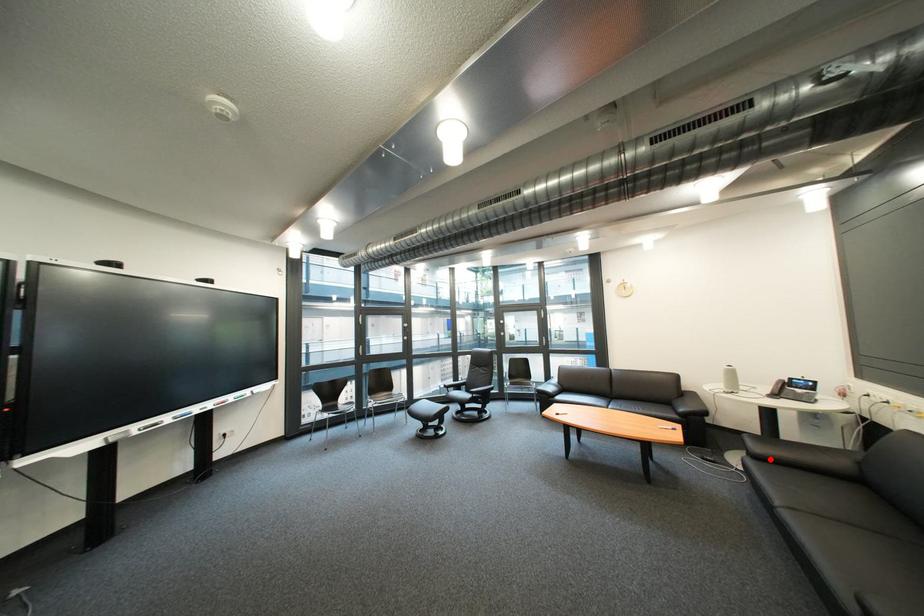
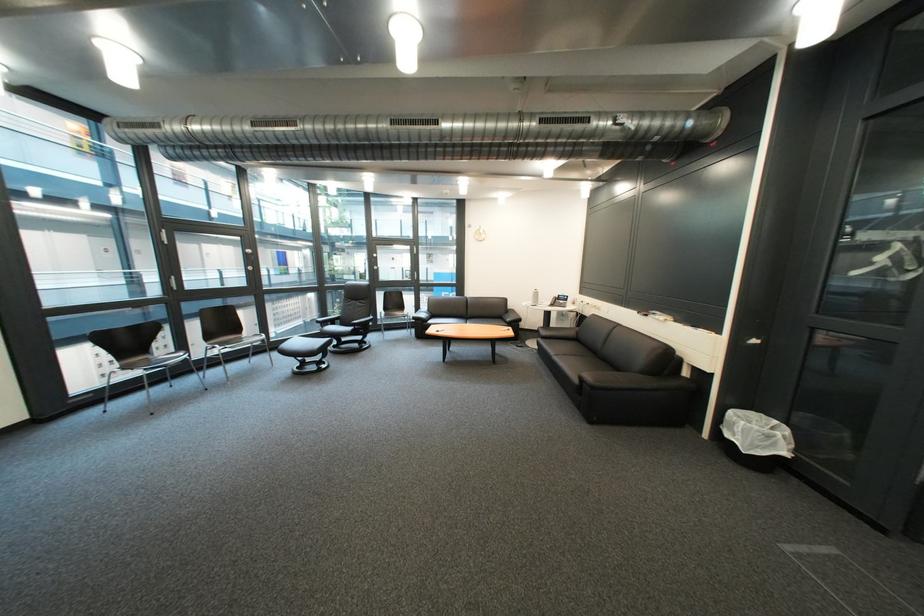
Question: I am providing you with two images of the same scene from different viewpoints. Image1 has a red point marked. In image2, the corresponding 3D location appears at what relative position? Reply with the corresponding letter.

Choices:
 (A) Closer
 (B) Farther

Answer: (A)